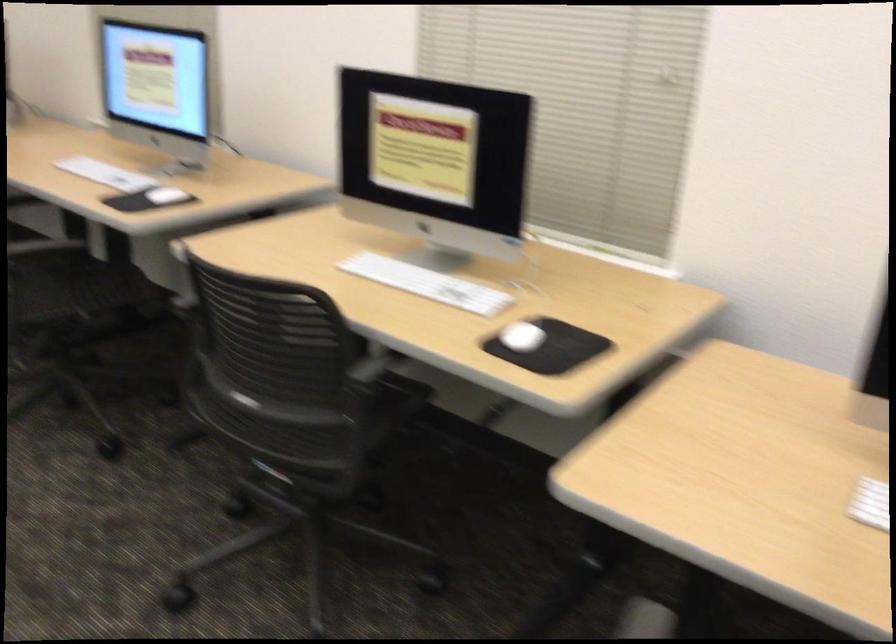
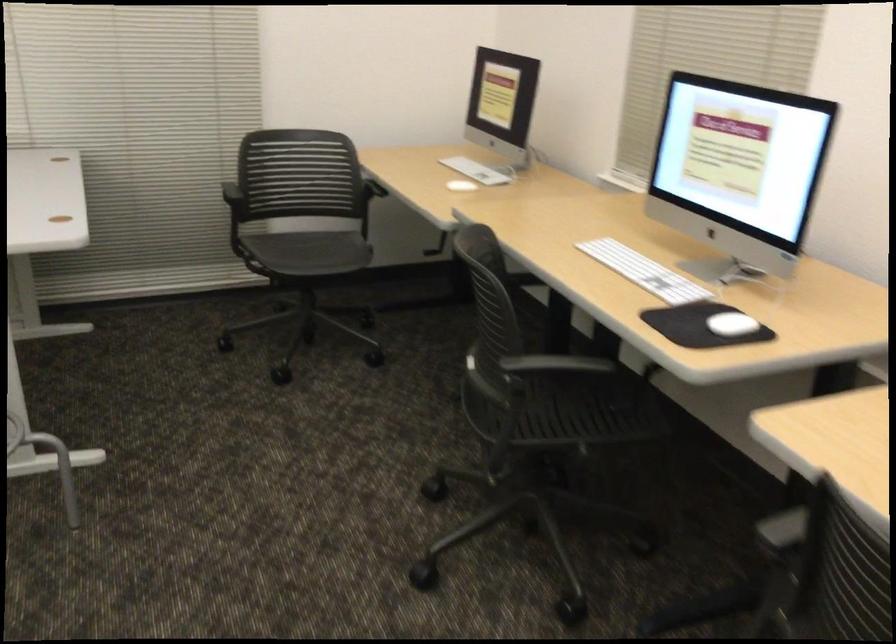
Question: The first image is from the beginning of the video and the second image is from the end. How did the camera likely rotate when shooting the video?

Choices:
 (A) Left
 (B) Right
 (C) Up
 (D) Down

Answer: (A)